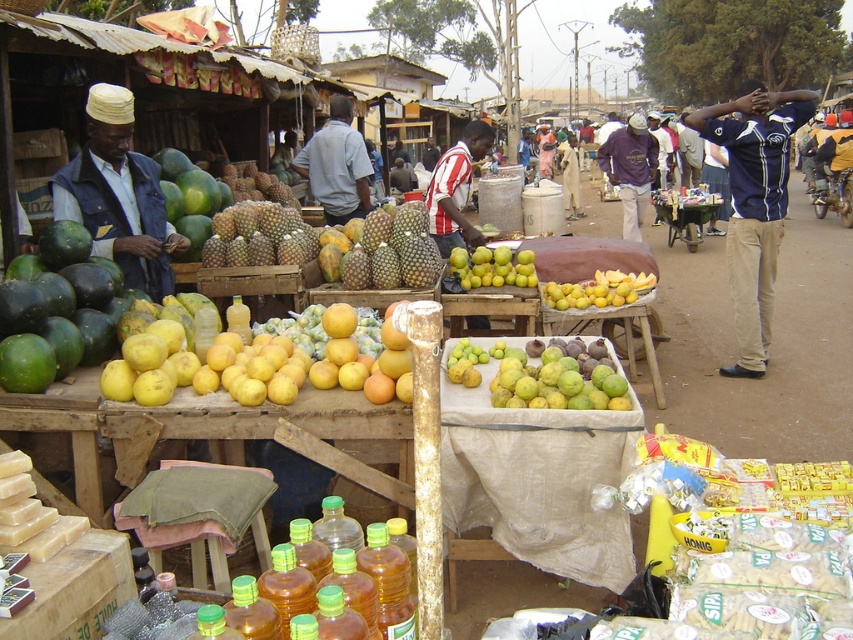
You are a customer at the market and want to locate the matte blue vest at left. Where exactly is it positioned in the scene?

The matte blue vest at left is located at point coordinates of (119, 195).

You are a vendor at the market and need to place a matte blue vest at left and a green matte pineapple at center into a box. Which item requires a wider space in the box?

The green matte pineapple at center requires a wider space in the box because the matte blue vest at left is narrower than it.

You are a delivery person needing to place a large package between the blue jersey at center and the purple cotton shirt at center. Given that the package is 8 feet long, will it fit in the space between them?

The distance between the blue jersey at center and the purple cotton shirt at center is 7.74 feet, so the 8 feet long package will not fit in the space between them.